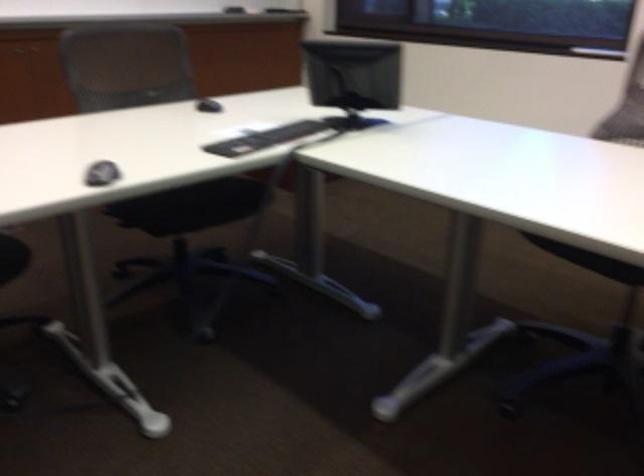
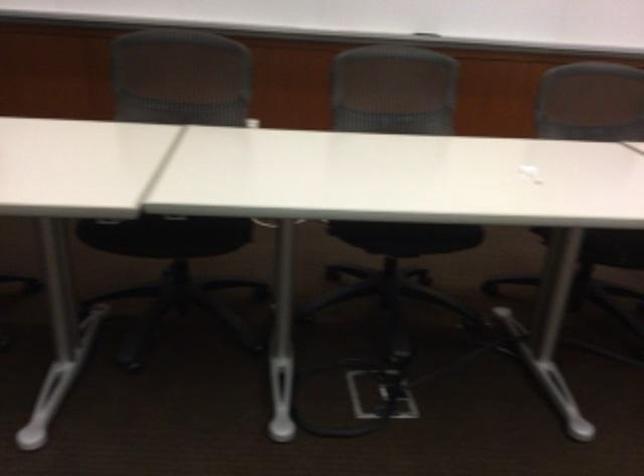
Question: How did the camera likely rotate?

Choices:
 (A) Left
 (B) Right
 (C) Up
 (D) Down

Answer: (A)